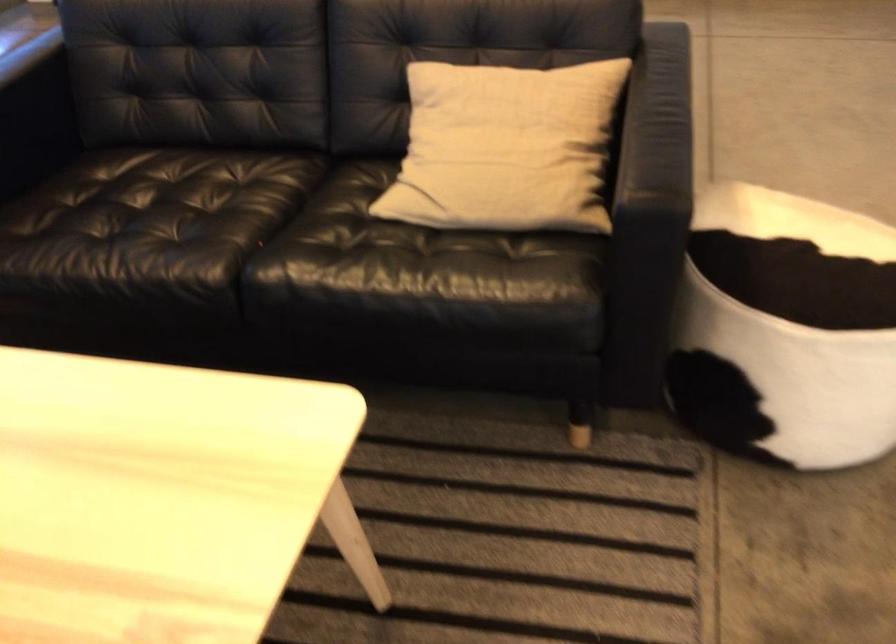
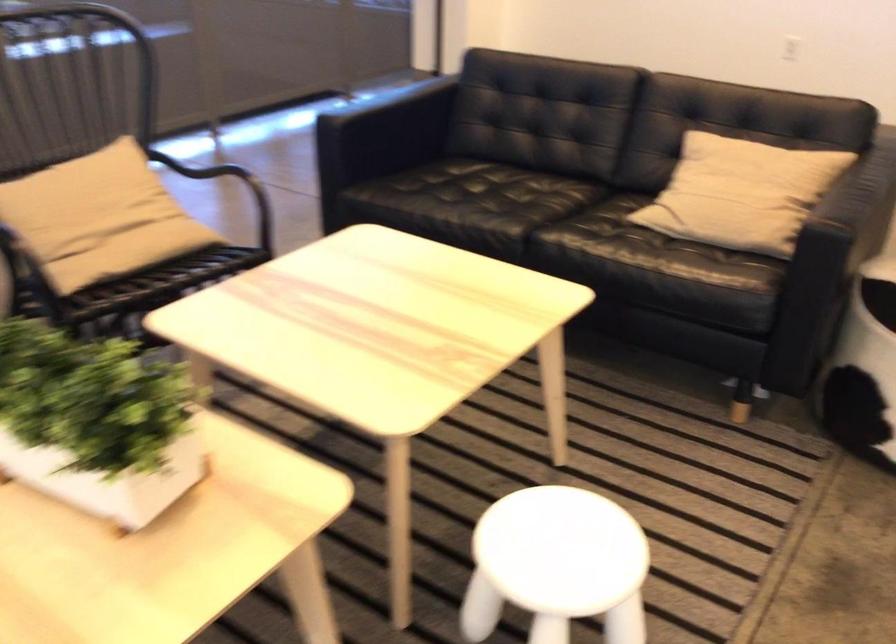
Where in the second image is the point corresponding to the point at 510,153 from the first image?

(741, 193)